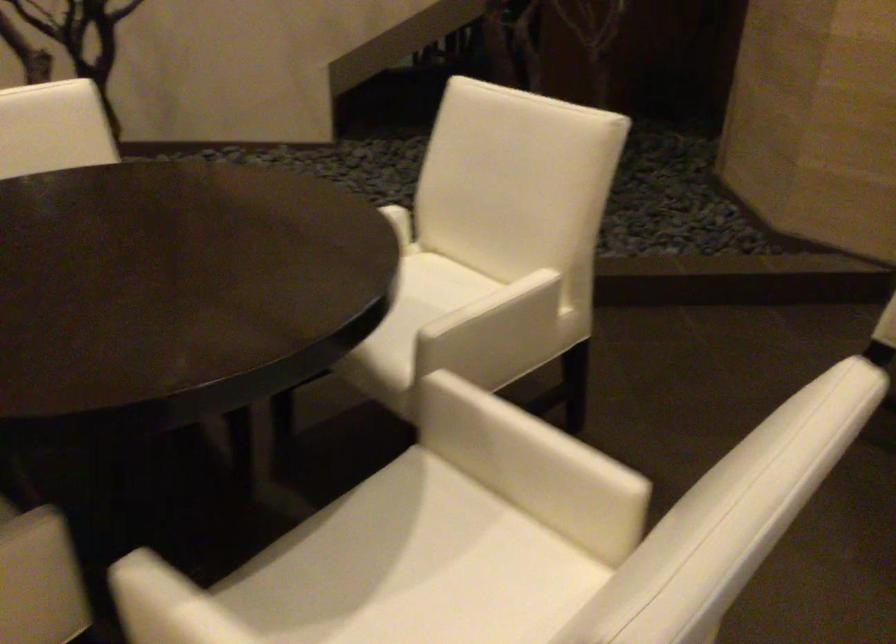
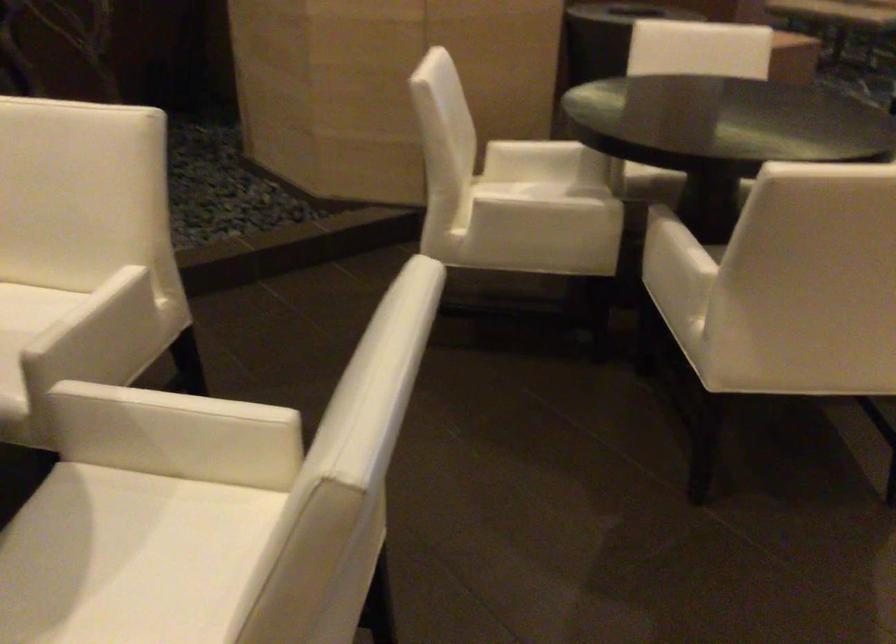
Where in the second image is the point corresponding to pixel 531 428 from the first image?

(179, 402)